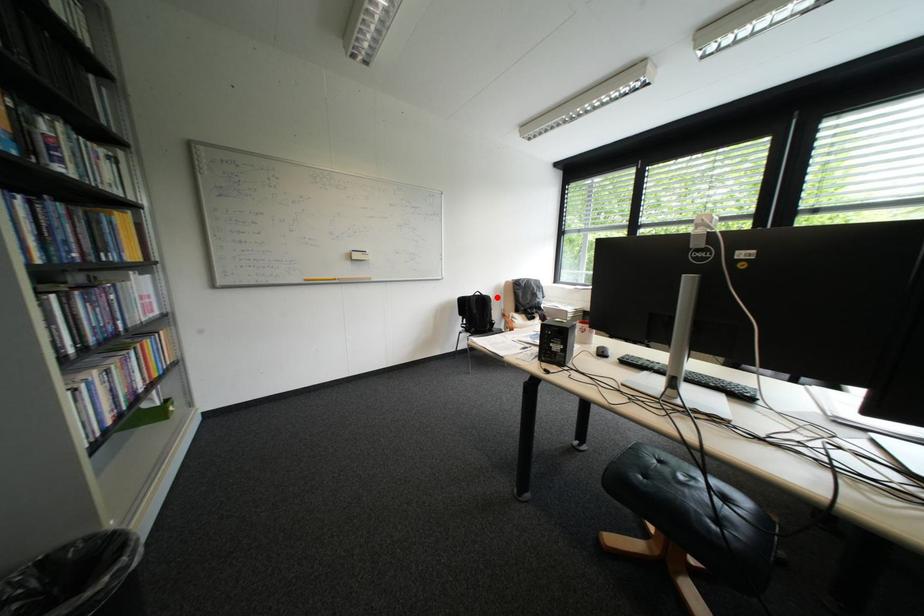
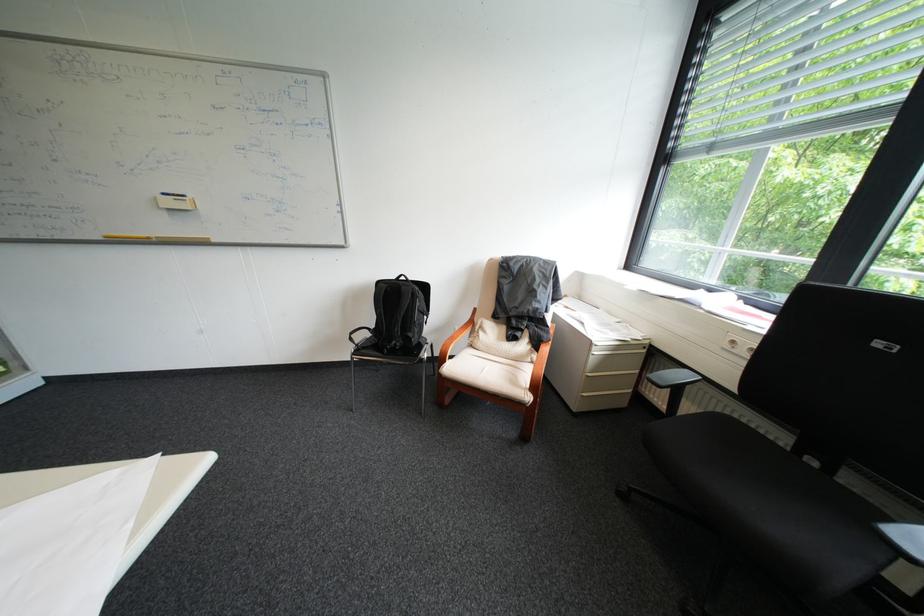
Where in the second image is the point corresponding to the highlighted location from the first image?

(415, 288)